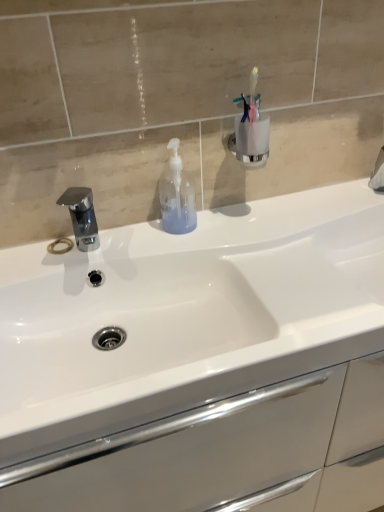
At what (x,y) coordinates should I click in order to perform the action: click on vacant space in front of translucent plastic soap dispenser at center. Please return your answer as a coordinate pair (x, y). The image size is (384, 512). Looking at the image, I should click on 177,247.